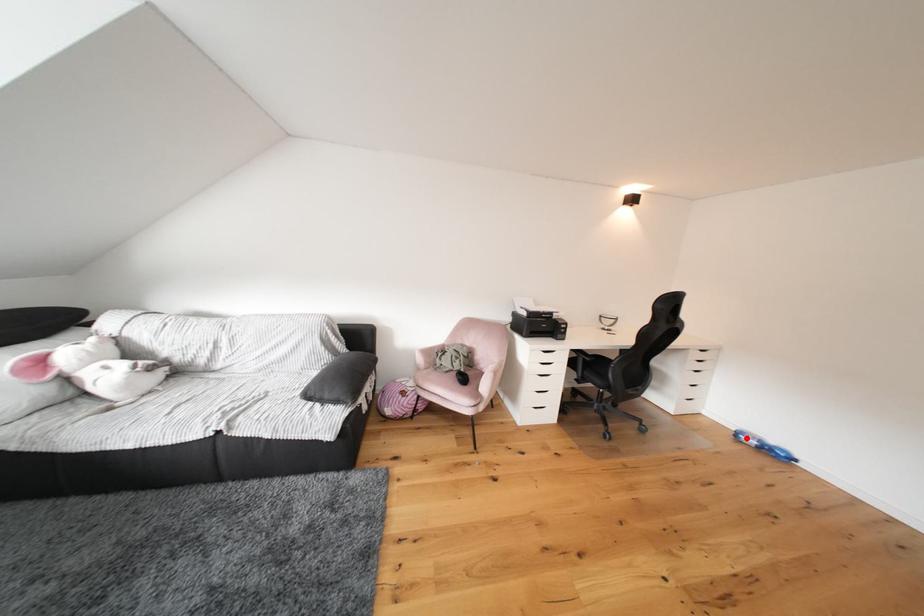
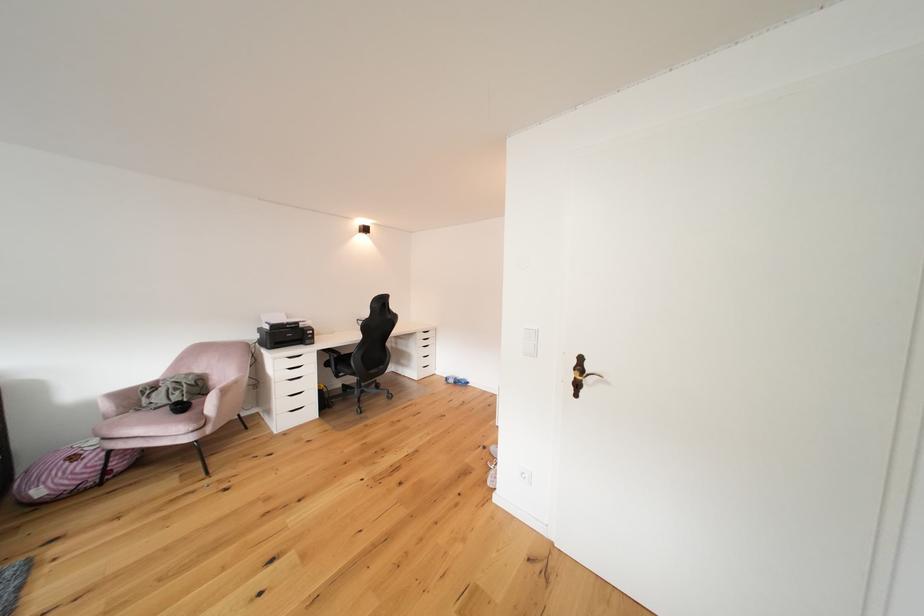
Question: A red point is marked in image1. In image2, is the corresponding 3D point closer to the camera or farther? Reply with the corresponding letter.

Choices:
 (A) The corresponding 3D point is closer.
 (B) The corresponding 3D point is farther.

Answer: (B)